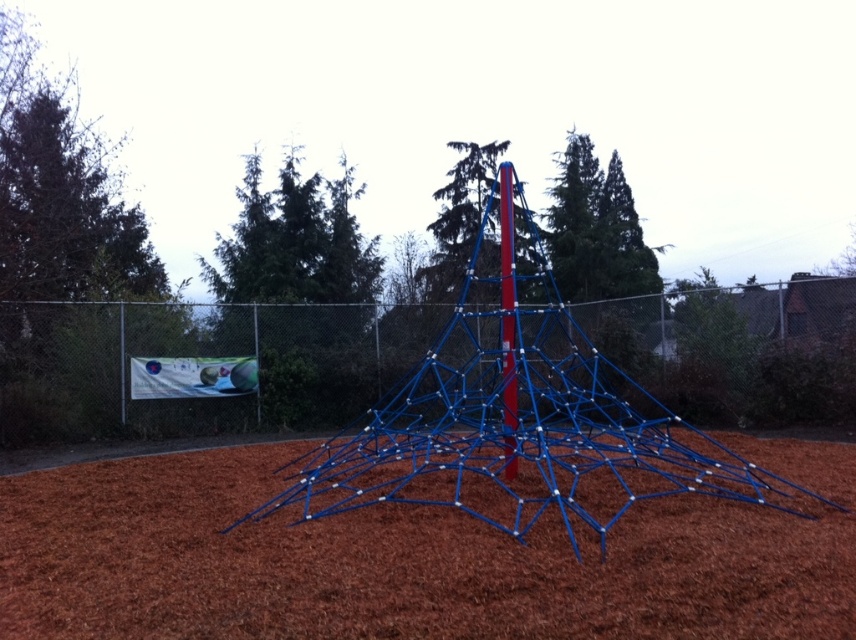
Between point (828, 486) and point (441, 410), which one is positioned behind?

Point (441, 410)

Can you confirm if brown mulch at center is shorter than blue metallic climbing frame at center?

Yes.

The height and width of the screenshot is (640, 856). In order to click on brown mulch at center in this screenshot , I will do `click(394, 563)`.

Does brown mulch at center have a lesser width compared to blue metallic pole at center?

In fact, brown mulch at center might be wider than blue metallic pole at center.

Can you confirm if brown mulch at center is smaller than blue metallic pole at center?

No, brown mulch at center is not smaller than blue metallic pole at center.

This screenshot has height=640, width=856. What do you see at coordinates (394, 563) in the screenshot?
I see `brown mulch at center` at bounding box center [394, 563].

Where is `brown mulch at center`? The height and width of the screenshot is (640, 856). brown mulch at center is located at coordinates (394, 563).

Does blue metallic climbing frame at center have a greater width compared to blue metallic pole at center?

Yes.

Measure the distance between blue metallic climbing frame at center and blue metallic pole at center.

They are 22.65 feet apart.

Is point (539, 486) more distant than point (504, 202)?

No, it is not.

Identify the location of blue metallic climbing frame at center. pyautogui.click(x=520, y=420).